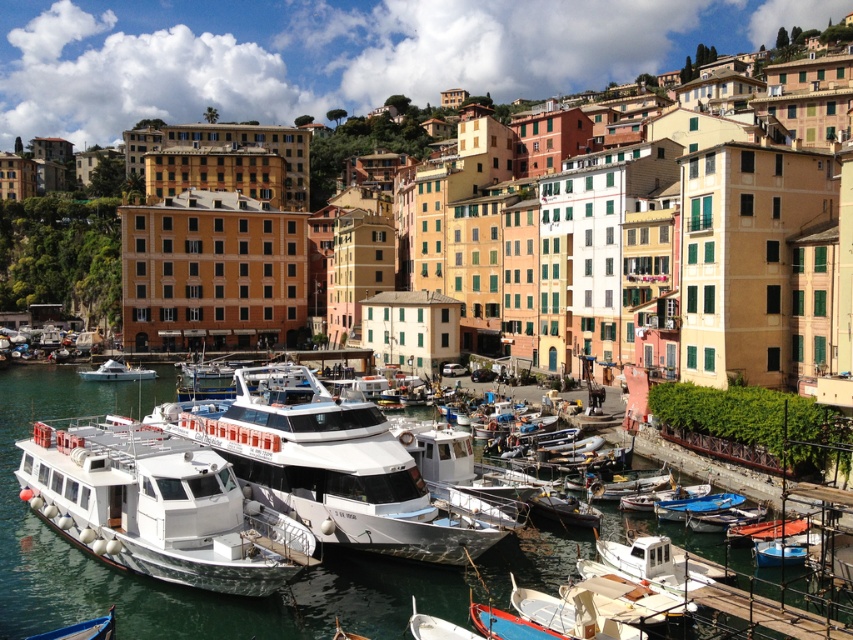
Based on the coordinates provided, can you identify the object located at point (177, 586) in the harbor scene?

The point (177, 586) corresponds to the white glossy water at center.

You are standing at the harbor and want to take a photo that includes both the point at (x=590, y=556) and the point at (x=207, y=474). Which point should you focus on first to ensure both are in focus?

You should focus on the point at (x=207, y=474) first because it is closer to you than the point at (x=590, y=556), which is further away. This way, both points will be within the depth of field.